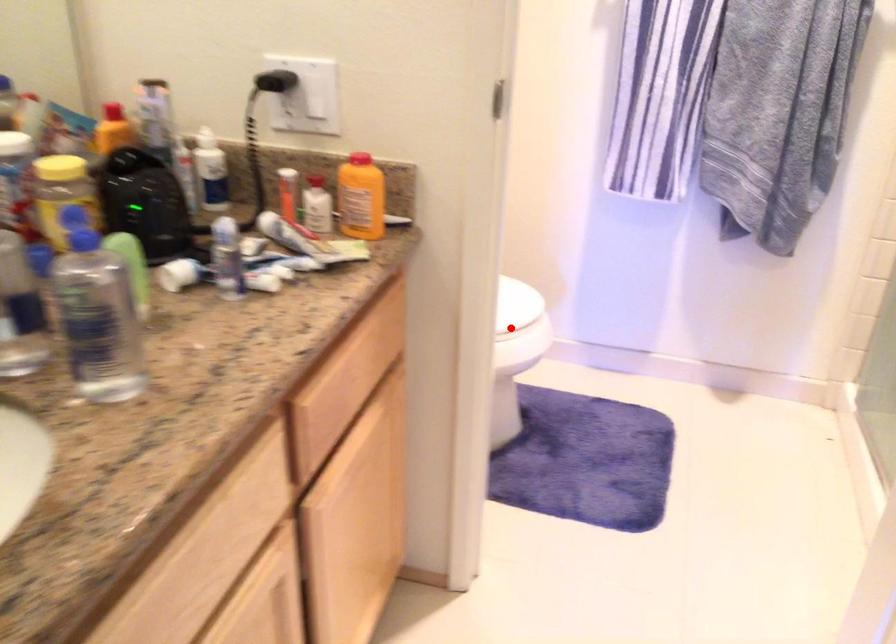
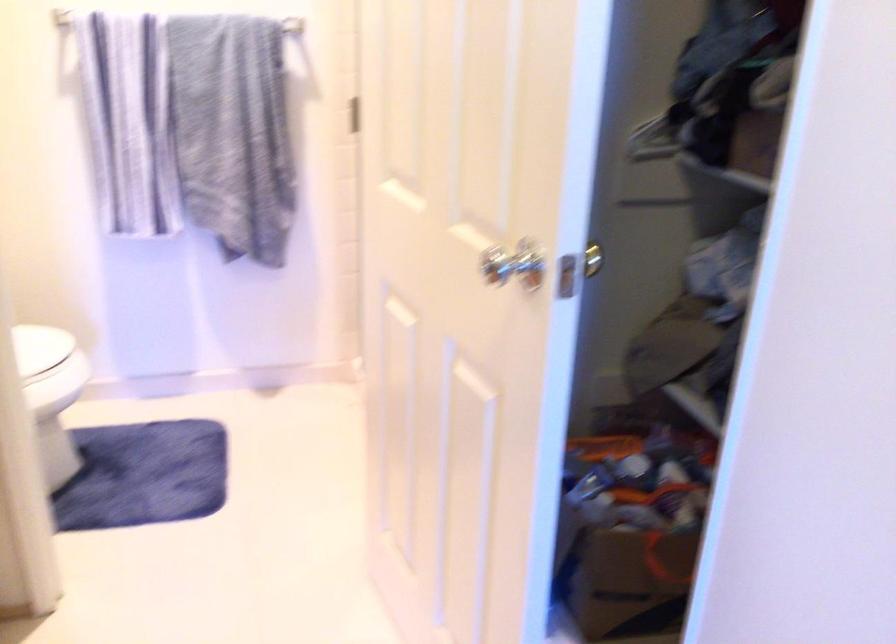
In the second image, find the point that corresponds to the highlighted location in the first image.

(45, 368)